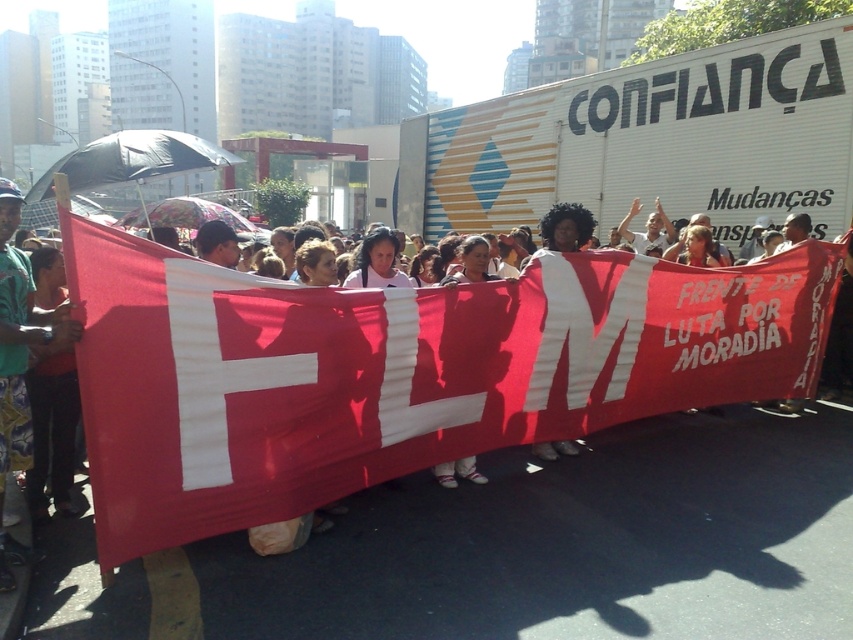
Is red fabric banner at center bigger than green fabric shirt at center?

Correct, red fabric banner at center is larger in size than green fabric shirt at center.

Is red fabric banner at center thinner than green fabric shirt at center?

No.

Is point (119, 308) closer to camera compared to point (18, 541)?

Yes, point (119, 308) is closer to viewer.

Identify the location of red fabric banner at center. This screenshot has width=853, height=640. (396, 371).